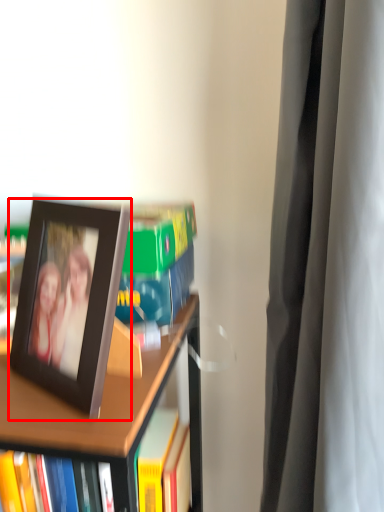
Question: From the image's perspective, what is the correct spatial positioning of picture frame (annotated by the red box) in reference to bookcase?

Choices:
 (A) above
 (B) below

Answer: (A)